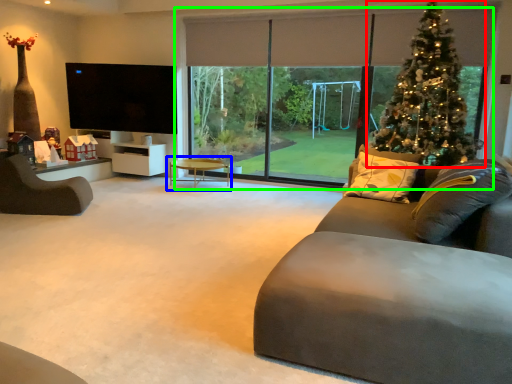
Question: Estimate the real-world distances between objects in this image. Which object is closer to christmas tree (highlighted by a red box), coffee table (highlighted by a blue box) or window (highlighted by a green box)?

Choices:
 (A) coffee table
 (B) window

Answer: (B)